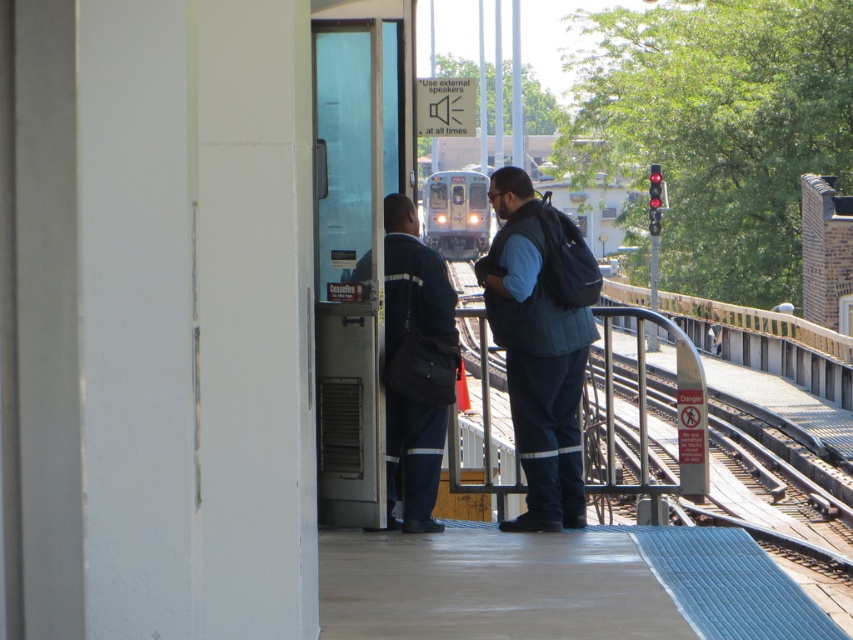
Looking at this image, you are a passenger waiting at the train station platform. You notice the dark blue uniform at center and the silver metallic train at center. Which object is taller? Please explain your reasoning based on the scene description.

The dark blue uniform at center is much taller than the silver metallic train at center according to the scene description.

You are a passenger waiting for your train at the station. You see the dark blue quilted vest at center and the silver metallic train at center. Which object is closer to the edge of the platform?

The dark blue quilted vest at center is located below the silver metallic train at center, meaning it is closer to the edge of the platform.